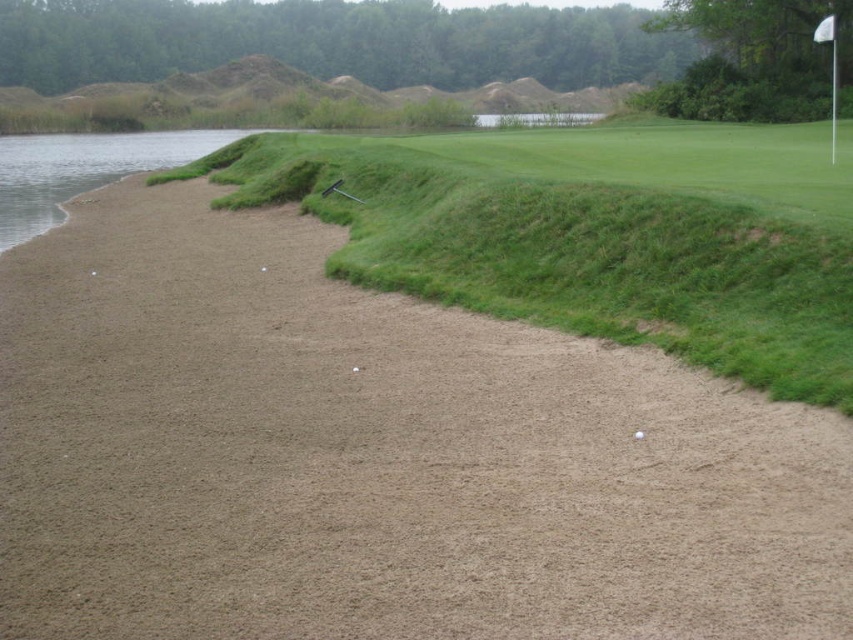
From the picture: Which of these two, brown sandy bunker at center-left or green grass at center, stands taller?

green grass at center

Is brown sandy bunker at center-left closer to camera compared to green grass at center?

Yes, brown sandy bunker at center-left is in front of green grass at center.

What are the coordinates of `brown sandy bunker at center-left` in the screenshot? It's located at (374, 456).

Describe the element at coordinates (374, 456) in the screenshot. I see `brown sandy bunker at center-left` at that location.

Who is lower down, brown sandy bunker at center-left or white matte golf ball at center?

white matte golf ball at center is below.

Where is `brown sandy bunker at center-left`? The width and height of the screenshot is (853, 640). brown sandy bunker at center-left is located at coordinates (374, 456).

You are a GUI agent. You are given a task and a screenshot of the screen. Output one action in this format:
    pyautogui.click(x=<x>, y=<y>)
    Task: Click on the brown sandy bunker at center-left
    Image resolution: width=853 pixels, height=640 pixels.
    Given the screenshot: What is the action you would take?
    click(x=374, y=456)

Who is higher up, green grass at center or white matte golf ball at center?

green grass at center is above.

Does green grass at center have a greater width compared to white matte golf ball at center?

Yes.

Identify the location of green grass at center. (593, 236).

Find the location of `green grass at center`. green grass at center is located at coordinates (593, 236).